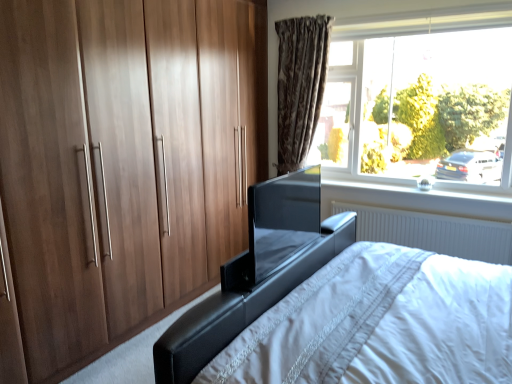
Question: Is white glossy window sill at upper right not within transparent glass tv at center?

Choices:
 (A) no
 (B) yes

Answer: (B)

Question: From a real-world perspective, is white glossy window sill at upper right on top of transparent glass tv at center?

Choices:
 (A) yes
 (B) no

Answer: (B)

Question: Does white glossy window sill at upper right have a greater height compared to transparent glass tv at center?

Choices:
 (A) no
 (B) yes

Answer: (A)

Question: Is white glossy window sill at upper right at the left side of transparent glass tv at center?

Choices:
 (A) yes
 (B) no

Answer: (B)

Question: Does white glossy window sill at upper right come behind transparent glass tv at center?

Choices:
 (A) no
 (B) yes

Answer: (B)

Question: Considering the positions of point (262, 223) and point (403, 205), is point (262, 223) closer or farther from the camera than point (403, 205)?

Choices:
 (A) farther
 (B) closer

Answer: (B)

Question: In terms of size, does transparent glass tv at center appear bigger or smaller than white glossy window sill at upper right?

Choices:
 (A) big
 (B) small

Answer: (A)

Question: From a real-world perspective, is transparent glass tv at center positioned above or below white glossy window sill at upper right?

Choices:
 (A) above
 (B) below

Answer: (A)

Question: Considering the relative positions of transparent glass tv at center and white glossy window sill at upper right in the image provided, is transparent glass tv at center to the left or to the right of white glossy window sill at upper right?

Choices:
 (A) left
 (B) right

Answer: (A)

Question: Considering the positions of black leather bed at center and transparent glass tv at center in the image, is black leather bed at center wider or thinner than transparent glass tv at center?

Choices:
 (A) thin
 (B) wide

Answer: (B)

Question: Is black leather bed at center inside the boundaries of transparent glass tv at center, or outside?

Choices:
 (A) outside
 (B) inside

Answer: (A)

Question: Considering the positions of black leather bed at center and transparent glass tv at center in the image, is black leather bed at center bigger or smaller than transparent glass tv at center?

Choices:
 (A) small
 (B) big

Answer: (B)

Question: From the image's perspective, is black leather bed at center located above or below transparent glass tv at center?

Choices:
 (A) below
 (B) above

Answer: (A)

Question: In the image, is transparent glass tv at center on the left side or the right side of brown textured curtain at upper center?

Choices:
 (A) left
 (B) right

Answer: (A)

Question: In terms of height, does transparent glass tv at center look taller or shorter compared to brown textured curtain at upper center?

Choices:
 (A) short
 (B) tall

Answer: (A)